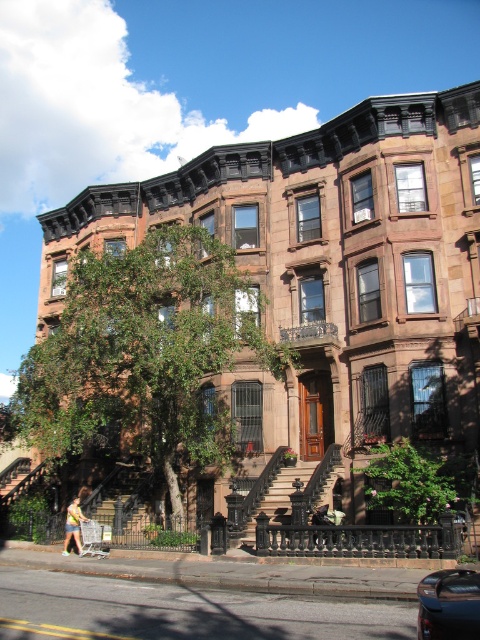
Question: Which point is closer to the camera?

Choices:
 (A) green leafy tree at left
 (B) shiny black car at lower right

Answer: (B)

Question: Is green leafy tree at left below shiny black car at lower right?

Choices:
 (A) no
 (B) yes

Answer: (A)

Question: Observing the image, what is the correct spatial positioning of green leafy tree at left in reference to shiny black car at lower right?

Choices:
 (A) below
 (B) above

Answer: (B)

Question: Is green leafy tree at left smaller than shiny black car at lower right?

Choices:
 (A) no
 (B) yes

Answer: (A)